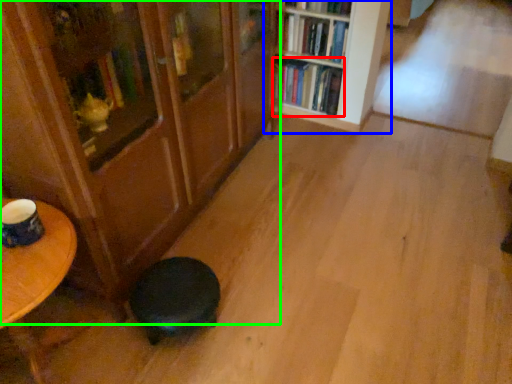
Question: Which object is the farthest from book (highlighted by a red box)? Choose among these: bookcase (highlighted by a blue box) or bookcase (highlighted by a green box).

Choices:
 (A) bookcase
 (B) bookcase

Answer: (B)